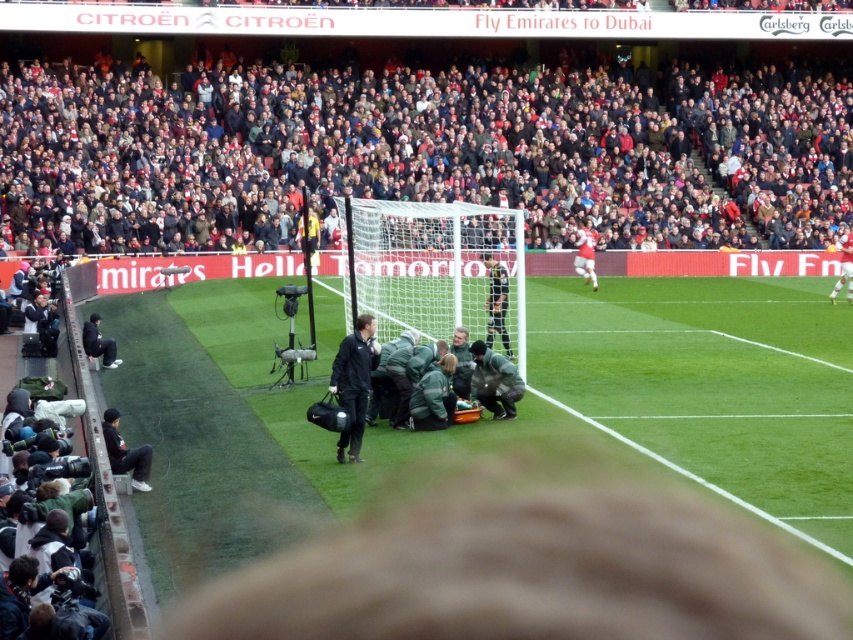
Describe the element at coordinates (431, 266) in the screenshot. I see `white net at center` at that location.

Who is positioned more to the left, white net at center or green fabric medical team at center?

green fabric medical team at center

Does point (408, 240) come behind point (367, 326)?

Yes, it is.

Where is `white net at center`? The image size is (853, 640). white net at center is located at coordinates (431, 266).

Is dark gray crowd at upper center thinner than green fabric medical team at center?

In fact, dark gray crowd at upper center might be wider than green fabric medical team at center.

Is point (157, 188) in front of point (405, 356)?

That is False.

Where is `dark gray crowd at upper center`? dark gray crowd at upper center is located at coordinates (424, 150).

Is green grass football field at center shorter than green fabric medical team at center?

No.

Who is lower down, green grass football field at center or green fabric medical team at center?

Positioned lower is green fabric medical team at center.

Describe the element at coordinates (708, 387) in the screenshot. I see `green grass football field at center` at that location.

Locate an element on the screen. This screenshot has height=640, width=853. green grass football field at center is located at coordinates (708, 387).